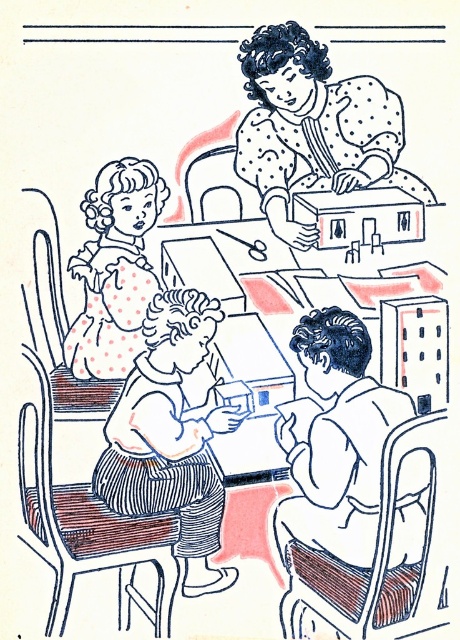
Is point (179, 397) positioned after point (136, 304)?

Yes, it is.

Between point (211, 300) and point (150, 284), which one is positioned behind?

The point (211, 300) is behind.

Where is `striped fabric skirt at center`? This screenshot has width=460, height=640. striped fabric skirt at center is located at coordinates [x=170, y=435].